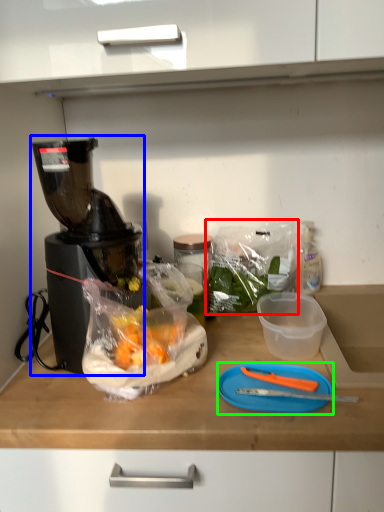
Question: Estimate the real-world distances between objects in this image. Which object is closer to plastic bag (highlighted by a red box), blender (highlighted by a blue box) or cutting board (highlighted by a green box)?

Choices:
 (A) blender
 (B) cutting board

Answer: (B)